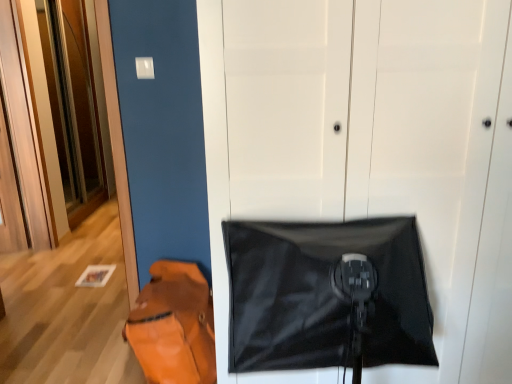
Question: Which direction should I rotate to look at black matte door at center, which appears as the second door when viewed from the left, — up or down?

Choices:
 (A) up
 (B) down

Answer: (B)

Question: From the image's perspective, is wooden at left, the second door in the front-to-back sequence, under leather-like orange messenger bag at lower left?

Choices:
 (A) yes
 (B) no

Answer: (B)

Question: Does wooden at left, acting as the 2th door starting from the right, lie behind leather-like orange messenger bag at lower left?

Choices:
 (A) yes
 (B) no

Answer: (A)

Question: Is wooden at left, acting as the 2th door starting from the right, to the right of leather-like orange messenger bag at lower left from the viewer's perspective?

Choices:
 (A) no
 (B) yes

Answer: (A)

Question: Is wooden at left, the second door in the front-to-back sequence, in front of leather-like orange messenger bag at lower left?

Choices:
 (A) no
 (B) yes

Answer: (A)

Question: Is wooden at left, arranged as the 1th door when viewed from the back, surrounding leather-like orange messenger bag at lower left?

Choices:
 (A) no
 (B) yes

Answer: (A)

Question: From the image's perspective, would you say wooden at left, acting as the 2th door starting from the right, is positioned over leather-like orange messenger bag at lower left?

Choices:
 (A) yes
 (B) no

Answer: (A)

Question: Would you say leather-like orange messenger bag at lower left is a long distance from black matte blanket at center?

Choices:
 (A) yes
 (B) no

Answer: (B)

Question: From the image's perspective, is leather-like orange messenger bag at lower left over black matte blanket at center?

Choices:
 (A) no
 (B) yes

Answer: (A)

Question: From a real-world perspective, is leather-like orange messenger bag at lower left physically above black matte blanket at center?

Choices:
 (A) no
 (B) yes

Answer: (A)

Question: Does leather-like orange messenger bag at lower left have a lesser height compared to black matte blanket at center?

Choices:
 (A) no
 (B) yes

Answer: (B)

Question: Is black matte blanket at center surrounded by leather-like orange messenger bag at lower left?

Choices:
 (A) no
 (B) yes

Answer: (A)

Question: Considering the relative sizes of leather-like orange messenger bag at lower left and black matte blanket at center in the image provided, is leather-like orange messenger bag at lower left taller than black matte blanket at center?

Choices:
 (A) no
 (B) yes

Answer: (A)

Question: Is black matte door at center, marked as the 1th door in a right-to-left arrangement, outside of leather-like orange messenger bag at lower left?

Choices:
 (A) yes
 (B) no

Answer: (A)